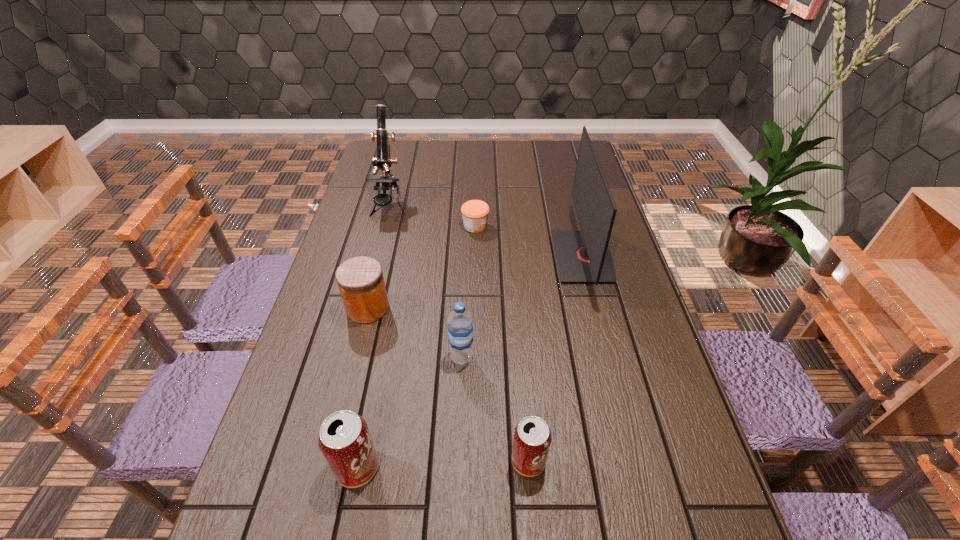
Where is `free space in the image that satisfies the following two spatial constraints: 1. through the eyepiece of the microscope; 2. on the right side of the taller soda can`? Image resolution: width=960 pixels, height=540 pixels. free space in the image that satisfies the following two spatial constraints: 1. through the eyepiece of the microscope; 2. on the right side of the taller soda can is located at coordinates (323, 468).

Identify the location of free point that satisfies the following two spatial constraints: 1. through the eyepiece of the left soda can; 2. on the left side of the microscope. (323, 468).

Where is `free location that satisfies the following two spatial constraints: 1. on the front label of the jam; 2. on the front side of the jar`? This screenshot has width=960, height=540. free location that satisfies the following two spatial constraints: 1. on the front label of the jam; 2. on the front side of the jar is located at coordinates (474, 308).